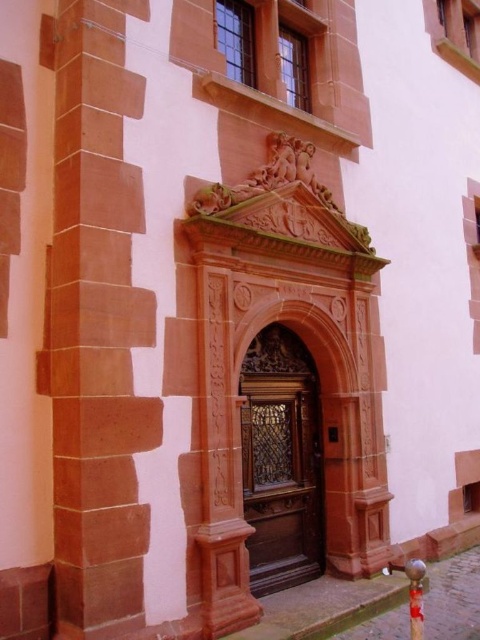
You are standing in front of the building and want to touch the shiny metallic pole at center. Can you reach it without opening the brown carved wood door at center?

The shiny metallic pole at center is behind the brown carved wood door at center, so you cannot reach it without opening the door first.

In the scene shown: You are an architect reviewing the building plans and notice the red stone pillar at left. What are the coordinates of this pillar in the architectural blueprint?

The red stone pillar at left is located at point (96, 328).

You are standing in front of the building and notice a red stone pillar at left. Can you tell me what is located at the point with coordinates (96, 328)?

The point at coordinates (96, 328) is where the red stone pillar at left is located.